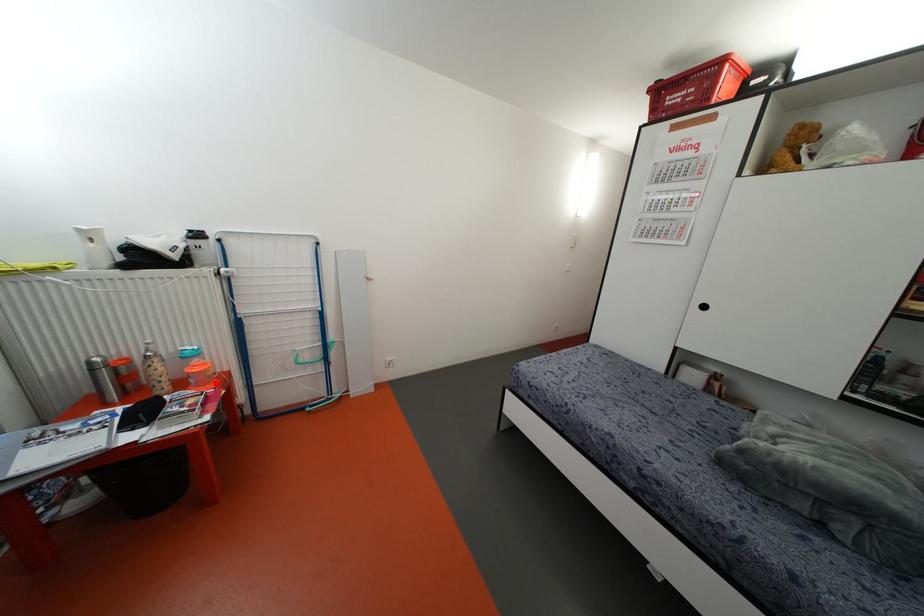
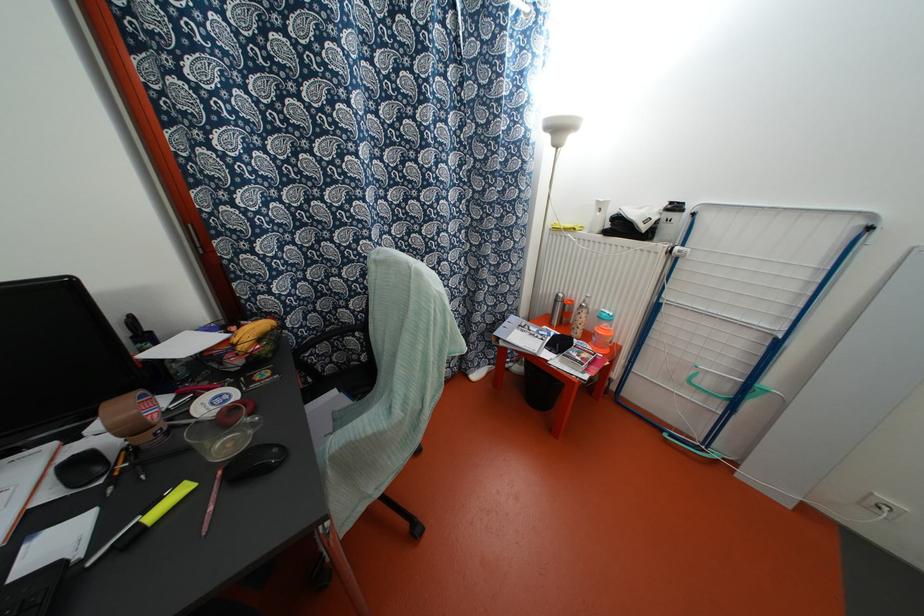
Question: I am providing you with two images of the same scene from different viewpoints. A red point is marked on the first image. Can you still see the location of the red point in image 2?

Choices:
 (A) Yes
 (B) No

Answer: (A)